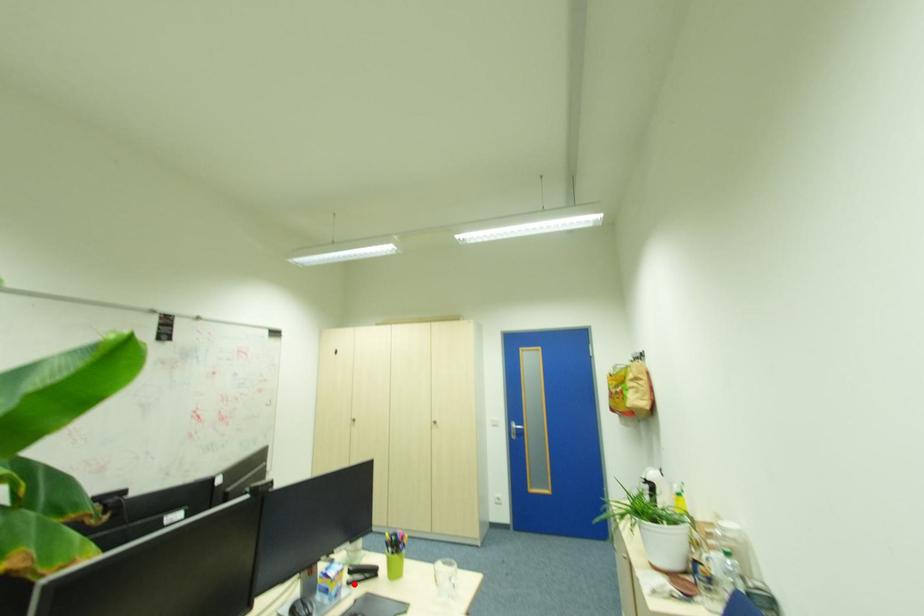
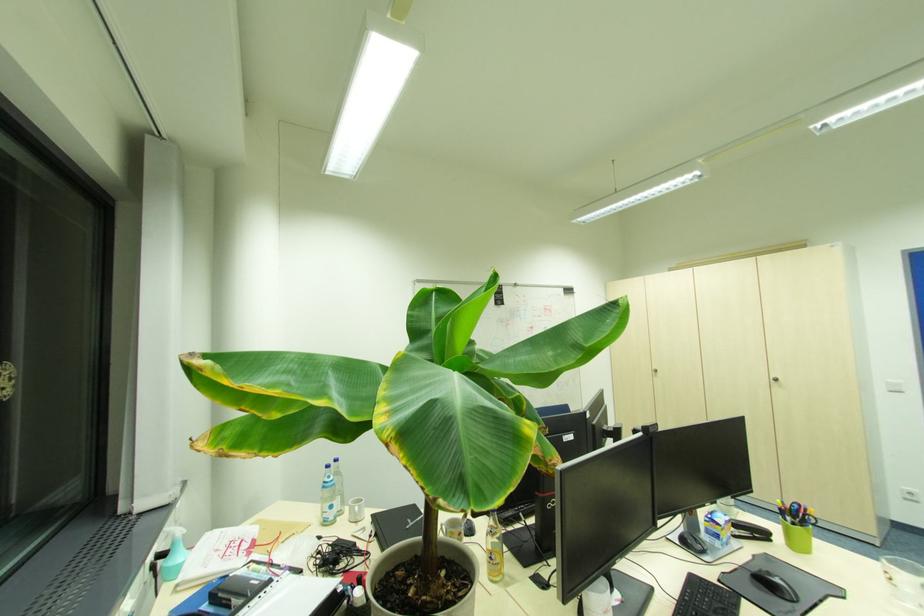
Locate, in the second image, the point that corresponds to the highlighted location in the first image.

(739, 538)